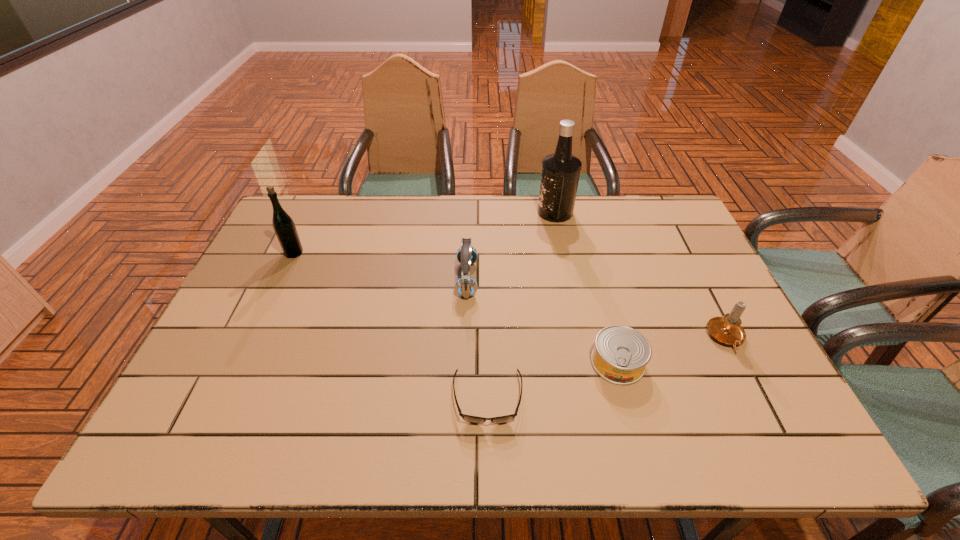
At what (x,y) coordinates should I click in order to perform the action: click on empty location between the second tallest object and the tallest object. Please return your answer as a coordinate pair (x, y). The height and width of the screenshot is (540, 960). Looking at the image, I should click on (424, 233).

The width and height of the screenshot is (960, 540). What are the coordinates of `unoccupied area between the beer bottle and the rightmost object` in the screenshot? It's located at (510, 295).

Find the location of `vacant space that's between the leftmost object and the sunglasses`. vacant space that's between the leftmost object and the sunglasses is located at coordinates (391, 326).

Identify the location of vacant area that lies between the rightmost object and the second tallest object. (510, 295).

Choose which object is the fifth nearest neighbor to the shortest object. Please provide its 2D coordinates. Your answer should be formatted as a tuple, i.e. [(x, y)], where the tuple contains the x and y coordinates of a point satisfying the conditions above.

[(283, 225)]

Identify the location of the closest object relative to the tallest object. This screenshot has width=960, height=540. (465, 286).

This screenshot has height=540, width=960. In order to click on vacant space that satisfies the following two spatial constraints: 1. on the front label of the liquor; 2. on the right side of the second shortest object in this screenshot , I will do `click(587, 362)`.

The height and width of the screenshot is (540, 960). Identify the location of blank area in the image that satisfies the following two spatial constraints: 1. on the front label of the liquor; 2. on the left side of the can. (587, 362).

Locate an element on the screen. The width and height of the screenshot is (960, 540). free space that satisfies the following two spatial constraints: 1. on the back side of the second shortest object; 2. on the front label of the liquor is located at coordinates (577, 212).

In order to click on vacant space that satisfies the following two spatial constraints: 1. on the back side of the can; 2. on the front label of the farthest object in this screenshot , I will do pyautogui.click(x=577, y=212).